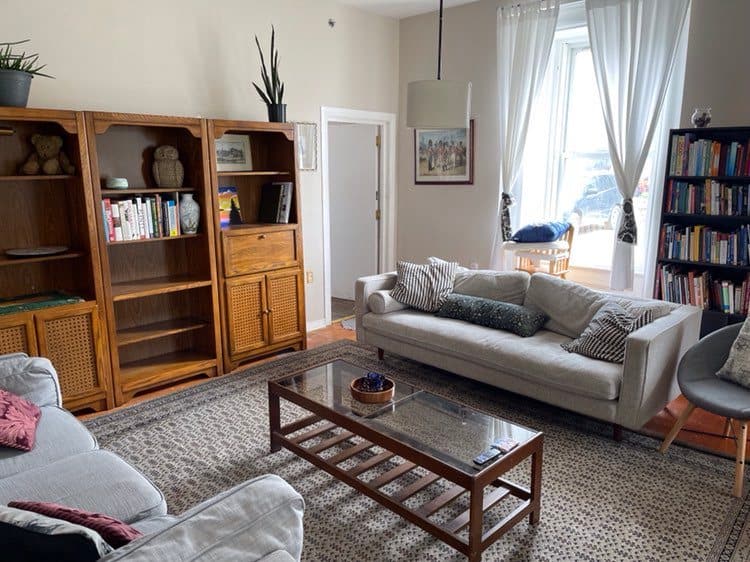
The image size is (750, 562). Find the location of `grey pillow`. grey pillow is located at coordinates (519, 321).